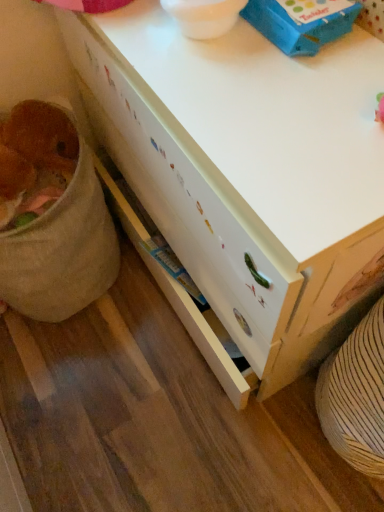
You are a GUI agent. You are given a task and a screenshot of the screen. Output one action in this format:
    pyautogui.click(x=<x>, y=<y>)
    Task: Click on the free space that is to the left of blue cardboard box at upper center
    
    Given the screenshot: What is the action you would take?
    pyautogui.click(x=172, y=54)